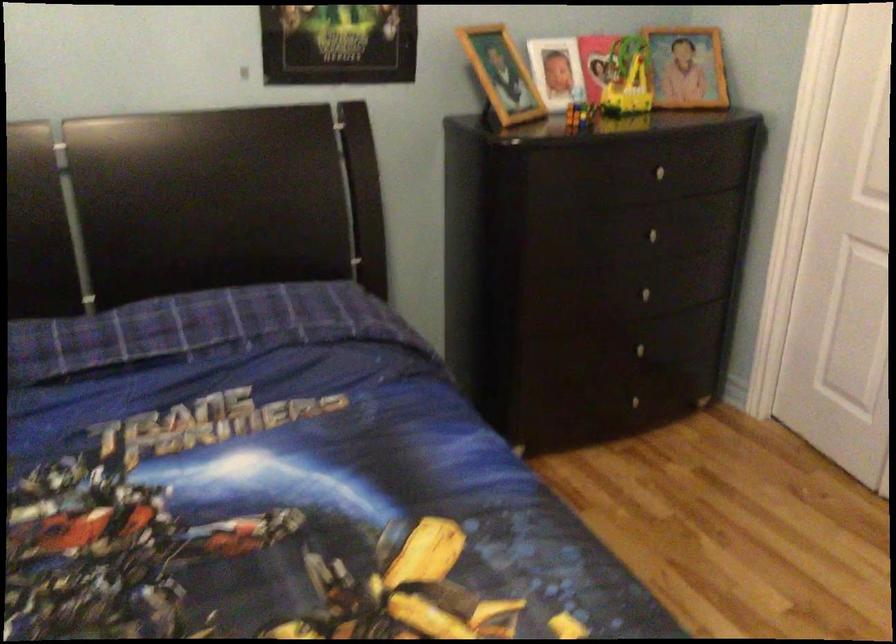
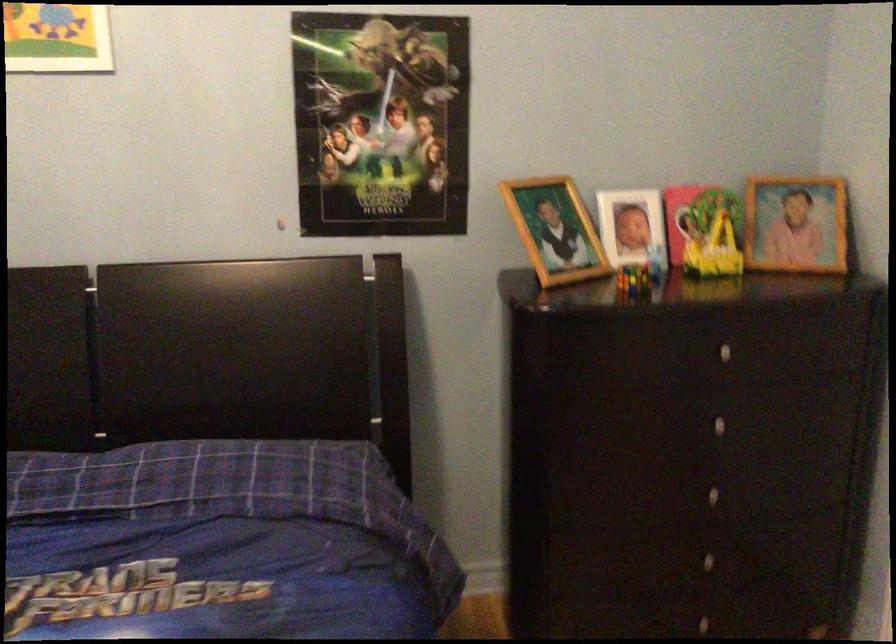
Find the pixel in the second image that matches the point at 501,75 in the first image.

(555, 230)